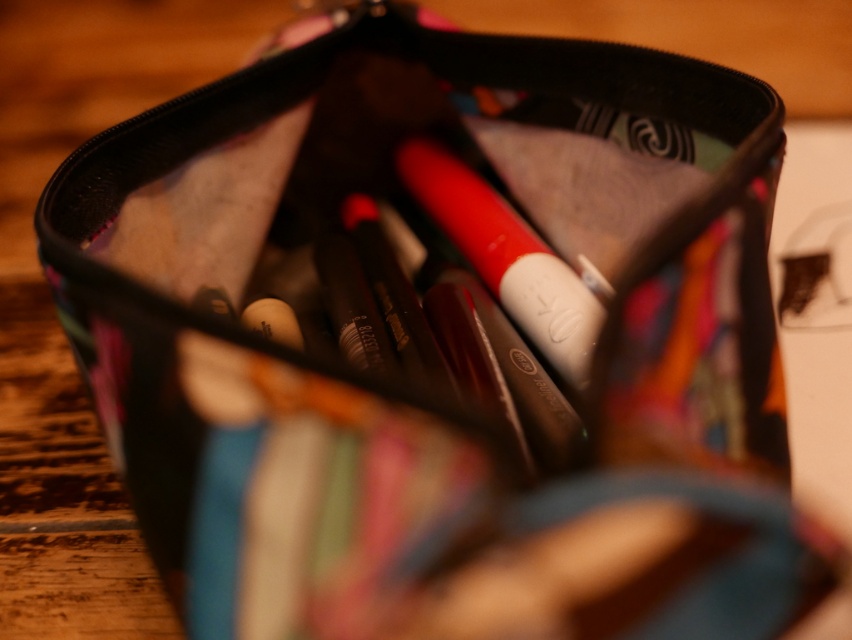
You are organizing your pencil case and need to place the matte white lipstick at center and the matte white eraser at center. If you want to arrange them so that the eraser is on the left side of the lipstick, are they currently positioned correctly?

The matte white lipstick at center is to the right of the matte white eraser at center, so currently they are positioned correctly with the eraser on the left side of the lipstick.

You have a small container that can only fit items up to 2 cm in width. You need to place either the matte white lipstick at center or the matte white eraser at center into it. Based on their widths, which item would you choose?

The matte white eraser at center is narrower than the matte white lipstick at center. Since the container can only hold items up to 2 cm in width, you should choose the matte white eraser at center to fit inside the container.

From the picture: You are organizing your desk and see the matte white lipstick at center and the matte white eraser at center inside your pencil case. Which item is closer to you when looking into the pencil case?

The matte white lipstick at center is closer to you because it is in front of the matte white eraser at center.